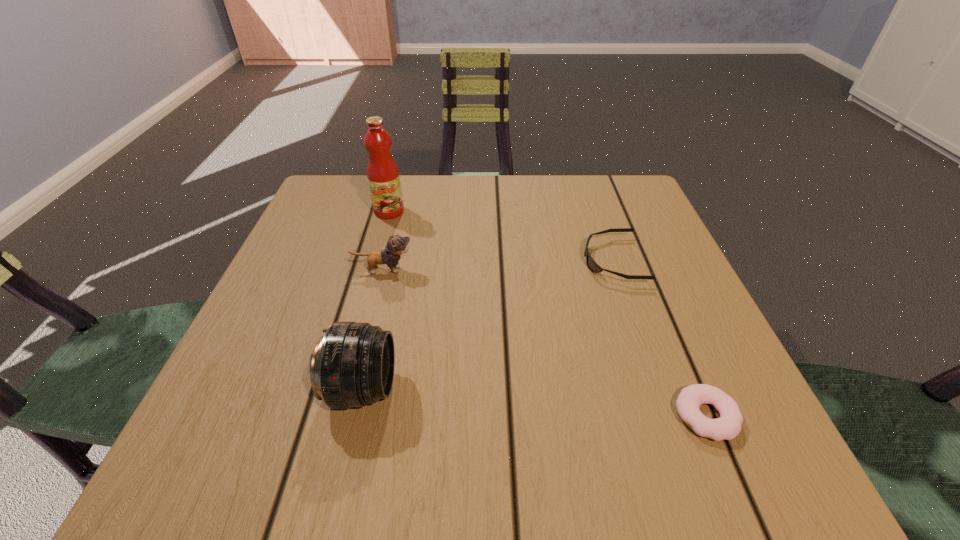
Where is `vacant region located 0.220m on the front-facing side of the sunglasses`? vacant region located 0.220m on the front-facing side of the sunglasses is located at coordinates (475, 260).

Where is `vacant space positioned on the front-facing side of the sunglasses`? vacant space positioned on the front-facing side of the sunglasses is located at coordinates [x=519, y=260].

Where is `free space located on the left of the doughnut`? The height and width of the screenshot is (540, 960). free space located on the left of the doughnut is located at coordinates (612, 416).

At what (x,y) coordinates should I click in order to perform the action: click on object present at the far edge. Please return your answer as a coordinate pair (x, y). Looking at the image, I should click on (383, 176).

This screenshot has width=960, height=540. Find the location of `telephoto lens situated at the near edge`. telephoto lens situated at the near edge is located at coordinates (353, 364).

Locate an element on the screen. doughnut present at the near edge is located at coordinates (728, 426).

I want to click on fruit juice at the left edge, so click(383, 176).

At what (x,y) coordinates should I click in order to perform the action: click on kitten that is at the left edge. Please return your answer as a coordinate pair (x, y). The image size is (960, 540). Looking at the image, I should click on (396, 245).

The image size is (960, 540). Identify the location of sunglasses positioned at the right edge. (592, 265).

Find the location of a particular element. The width and height of the screenshot is (960, 540). doughnut located at the right edge is located at coordinates (728, 426).